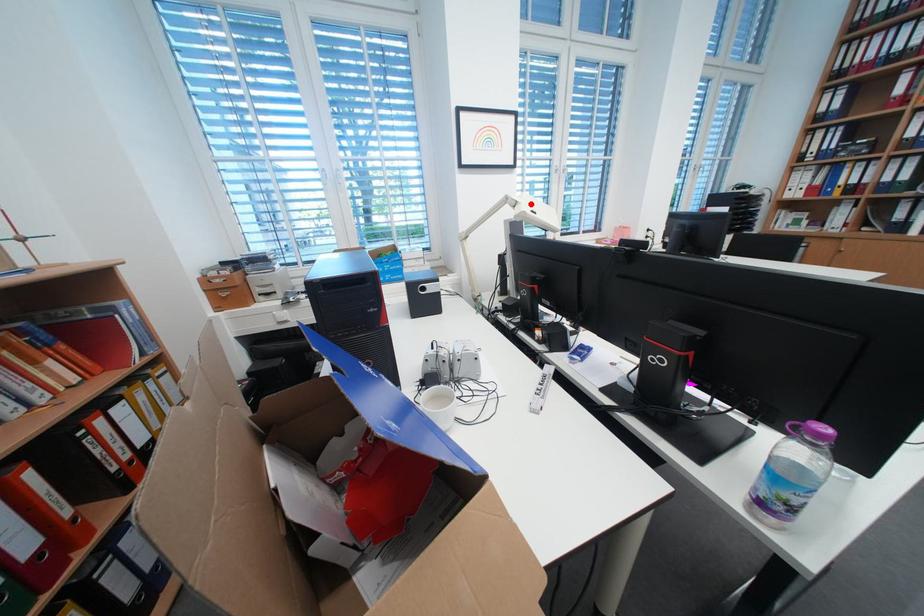
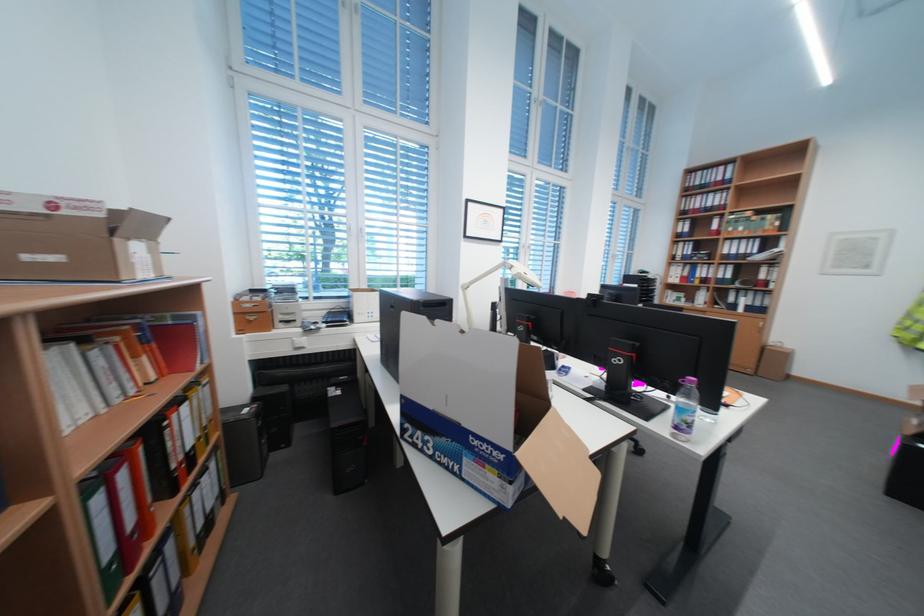
Question: I am providing you with two images of the same scene from different viewpoints. A red point is marked on the first image. Is the red point's position out of view in image 2?

Choices:
 (A) Yes
 (B) No

Answer: (B)